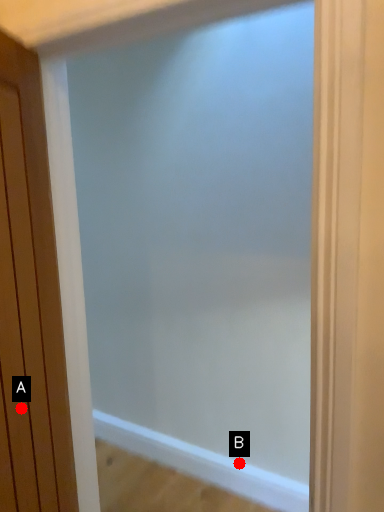
Question: Two points are circled on the image, labeled by A and B beside each circle. Which point is farther from the camera taking this photo?

Choices:
 (A) A is further
 (B) B is further

Answer: (B)